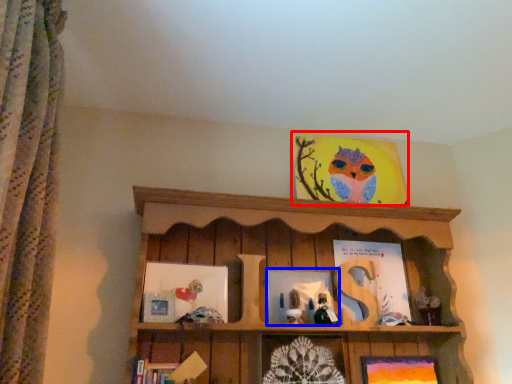
Question: Among these objects, which one is farthest to the camera, picture frame (highlighted by a red box) or picture frame (highlighted by a blue box)?

Choices:
 (A) picture frame
 (B) picture frame

Answer: (A)